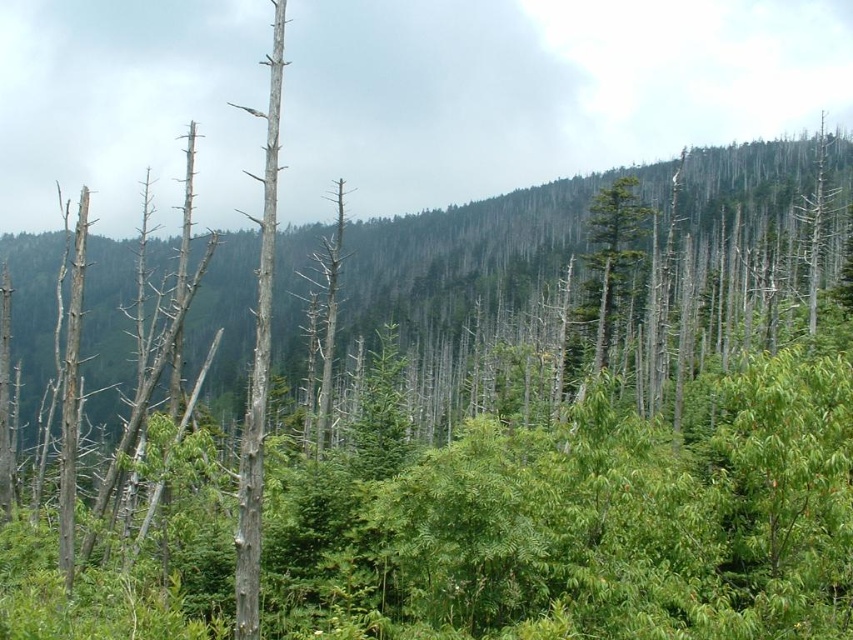
Is green leafy trees at center smaller than green matte tree at center?

Incorrect, green leafy trees at center is not smaller in size than green matte tree at center.

Locate an element on the screen. The height and width of the screenshot is (640, 853). green leafy trees at center is located at coordinates (460, 259).

Find the location of a particular element. This screenshot has height=640, width=853. green leafy trees at center is located at coordinates (460, 259).